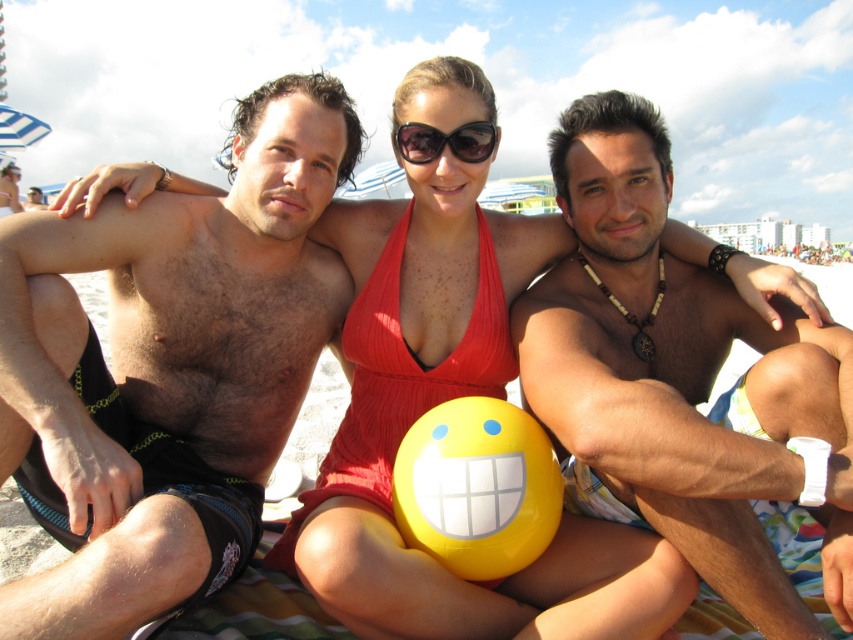
In the scene shown: Who is more forward, [471,552] or [477,150]?

Point [471,552] is in front.

How distant is yellow matte/vinyl volleyball at center from sunglasses at center?

They are 2.91 meters apart.

Which is behind, point (428, 483) or point (440, 134)?

Point (440, 134)

Identify the location of yellow matte/vinyl volleyball at center. This screenshot has width=853, height=640. (477, 486).

Is sunglasses at center shorter than matte red swimsuit at center?

Indeed, sunglasses at center has a lesser height compared to matte red swimsuit at center.

Who is positioned more to the right, sunglasses at center or matte red swimsuit at center?

From the viewer's perspective, sunglasses at center appears more on the right side.

Which is behind, point (489, 140) or point (6, 170)?

Point (6, 170)

I want to click on sunglasses at center, so click(445, 141).

Does smooth tan skin at center have a lesser height compared to sunglasses at center?

No, smooth tan skin at center is not shorter than sunglasses at center.

Is point (833, 532) positioned after point (486, 131)?

That is False.

In order to click on smooth tan skin at center in this screenshot , I will do `click(674, 372)`.